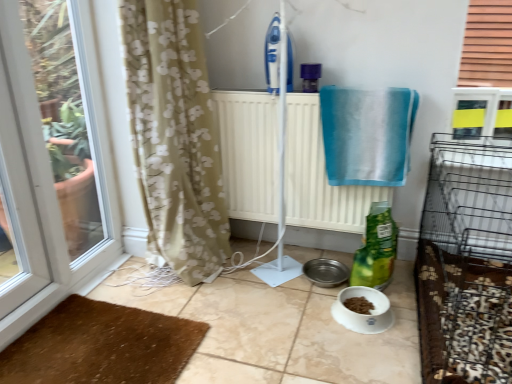
Question: Can you confirm if white radiator at center is positioned to the right of blue fabric towel at upper right?

Choices:
 (A) no
 (B) yes

Answer: (A)

Question: Is white radiator at center further to camera compared to blue fabric towel at upper right?

Choices:
 (A) yes
 (B) no

Answer: (A)

Question: Is white radiator at center located outside blue fabric towel at upper right?

Choices:
 (A) no
 (B) yes

Answer: (B)

Question: Does white radiator at center have a greater width compared to blue fabric towel at upper right?

Choices:
 (A) yes
 (B) no

Answer: (B)

Question: Are white radiator at center and blue fabric towel at upper right far apart?

Choices:
 (A) no
 (B) yes

Answer: (A)

Question: From the image's perspective, is white radiator at center on blue fabric towel at upper right?

Choices:
 (A) yes
 (B) no

Answer: (B)

Question: Is brown textured mat at lower left positioned behind green matte bag at lower center?

Choices:
 (A) yes
 (B) no

Answer: (B)

Question: Is brown textured mat at lower left bigger than green matte bag at lower center?

Choices:
 (A) no
 (B) yes

Answer: (B)

Question: From the image's perspective, does brown textured mat at lower left appear lower than green matte bag at lower center?

Choices:
 (A) yes
 (B) no

Answer: (A)

Question: Is brown textured mat at lower left shorter than green matte bag at lower center?

Choices:
 (A) no
 (B) yes

Answer: (B)

Question: From the image's perspective, would you say brown textured mat at lower left is positioned over green matte bag at lower center?

Choices:
 (A) no
 (B) yes

Answer: (A)

Question: Is brown textured mat at lower left aimed at green matte bag at lower center?

Choices:
 (A) yes
 (B) no

Answer: (B)

Question: Considering the relative sizes of blue fabric towel at upper right and green matte bag at lower center in the image provided, is blue fabric towel at upper right wider than green matte bag at lower center?

Choices:
 (A) yes
 (B) no

Answer: (A)